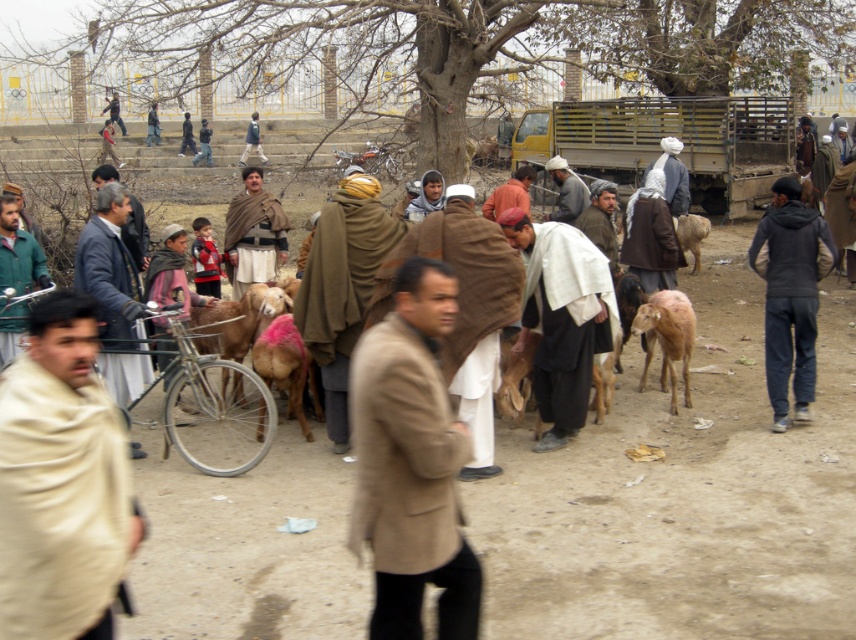
Looking at this image, you are a traveler who wants to choose between the beige wool coat at center and the light brown woolen jacket at left for protection against the cold. Based on their sizes, which one would provide more coverage and warmth?

The beige wool coat at center has a greater height compared to the light brown woolen jacket at left, so it would provide more coverage and warmth.

You are a traveler standing at the edge of the market and see the light brown woolen goat at center and the light brown woolen sheep at center. Which animal is positioned lower in the image?

The light brown woolen goat at center is positioned lower than the light brown woolen sheep at center.

You are a traveler who wants to set up a tent in the brown dirt field at center. However, you notice the brown woolen robe at center is also present. Can you determine if there is enough space to set up your tent without overlapping the robe?

The brown dirt field at center has a larger size compared to brown woolen robe at center, so there is enough space to set up the tent without overlapping the robe.